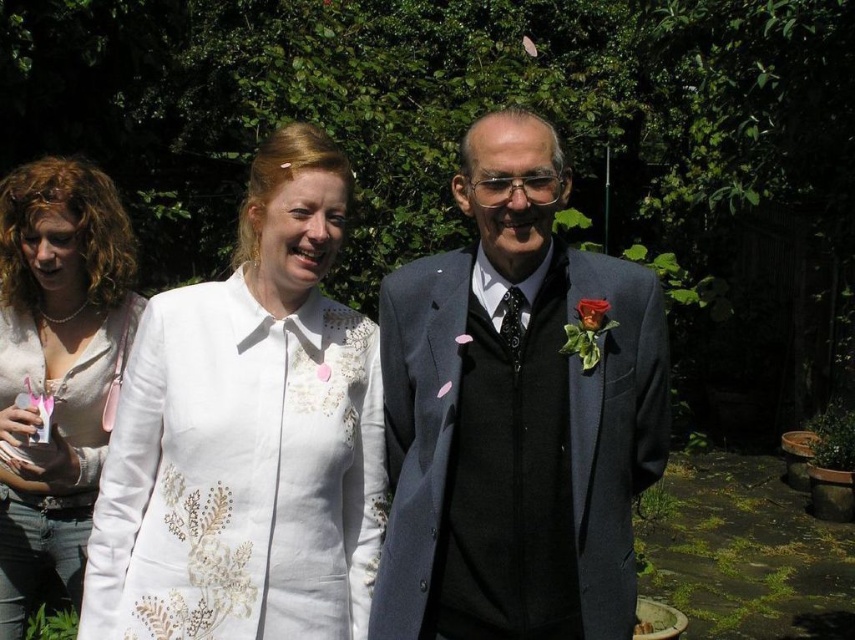
Between white embroidered blouse at center and matte white blouse at center, which one appears on the left side from the viewer's perspective?

matte white blouse at center

Is point (161, 547) less distant than point (75, 593)?

Yes, it is.

What do you see at coordinates (246, 435) in the screenshot? I see `white embroidered blouse at center` at bounding box center [246, 435].

This screenshot has width=855, height=640. I want to click on white embroidered blouse at center, so tap(246, 435).

Between white textured coat at center and matte white blouse at center, which one has less height?

white textured coat at center is shorter.

The width and height of the screenshot is (855, 640). What do you see at coordinates (516, 413) in the screenshot?
I see `white textured coat at center` at bounding box center [516, 413].

This screenshot has width=855, height=640. I want to click on white textured coat at center, so click(516, 413).

Which is behind, point (531, 588) or point (296, 476)?

The point (531, 588) is more distant.

Can you confirm if matte gray suit at center is positioned above white embroidered blouse at center?

Yes, matte gray suit at center is above white embroidered blouse at center.

Locate an element on the screen. Image resolution: width=855 pixels, height=640 pixels. matte gray suit at center is located at coordinates (516, 416).